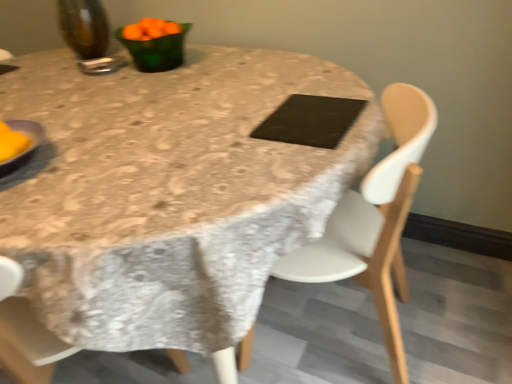
Question: Can you confirm if black matte pad at center is shorter than green glass bowl at upper left, the first tableware in the right-to-left sequence?

Choices:
 (A) no
 (B) yes

Answer: (B)

Question: From a real-world perspective, is black matte pad at center on top of green glass bowl at upper left, the first tableware in the right-to-left sequence?

Choices:
 (A) no
 (B) yes

Answer: (A)

Question: From the image's perspective, is black matte pad at center below green glass bowl at upper left, the first tableware in the right-to-left sequence?

Choices:
 (A) no
 (B) yes

Answer: (B)

Question: Does black matte pad at center appear on the right side of green glass bowl at upper left, the 2th tableware when ordered from left to right?

Choices:
 (A) no
 (B) yes

Answer: (B)

Question: Is black matte pad at center smaller than green glass bowl at upper left, the 2th tableware when ordered from left to right?

Choices:
 (A) yes
 (B) no

Answer: (A)

Question: Is black matte pad at center positioned behind green glass bowl at upper left, the first tableware in the right-to-left sequence?

Choices:
 (A) yes
 (B) no

Answer: (B)

Question: Would you say yellow matte plate at left is a long distance from black matte pad at center?

Choices:
 (A) yes
 (B) no

Answer: (B)

Question: Can you confirm if yellow matte plate at left is shorter than black matte pad at center?

Choices:
 (A) yes
 (B) no

Answer: (B)

Question: Does yellow matte plate at left turn towards black matte pad at center?

Choices:
 (A) yes
 (B) no

Answer: (B)

Question: From a real-world perspective, is yellow matte plate at left located beneath black matte pad at center?

Choices:
 (A) no
 (B) yes

Answer: (A)

Question: From a real-world perspective, is yellow matte plate at left on black matte pad at center?

Choices:
 (A) yes
 (B) no

Answer: (A)

Question: From the image's perspective, would you say yellow matte plate at left is shown under black matte pad at center?

Choices:
 (A) yes
 (B) no

Answer: (A)

Question: Is black matte pad at center in front of yellow matte plate at left?

Choices:
 (A) no
 (B) yes

Answer: (A)